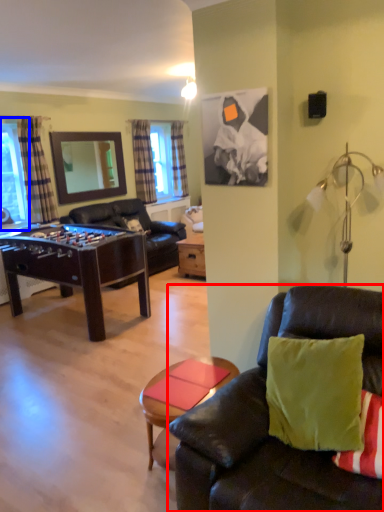
Question: Which of the following is the farthest to the observer, studio couch (highlighted by a red box) or window screen (highlighted by a blue box)?

Choices:
 (A) studio couch
 (B) window screen

Answer: (B)